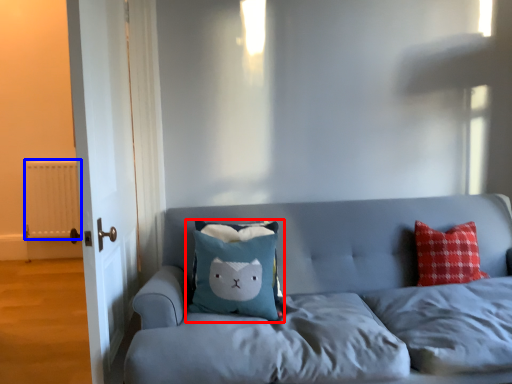
Question: Which point is further to the camera, pillow (highlighted by a red box) or radiator (highlighted by a blue box)?

Choices:
 (A) pillow
 (B) radiator

Answer: (B)